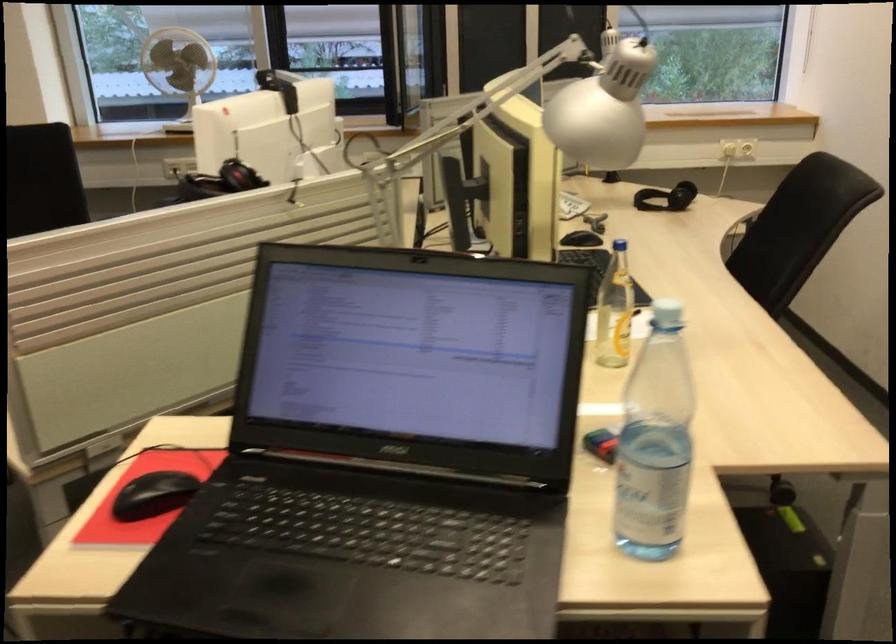
The location [655,442] corresponds to which object?

This point indicates the plastic water bottle.